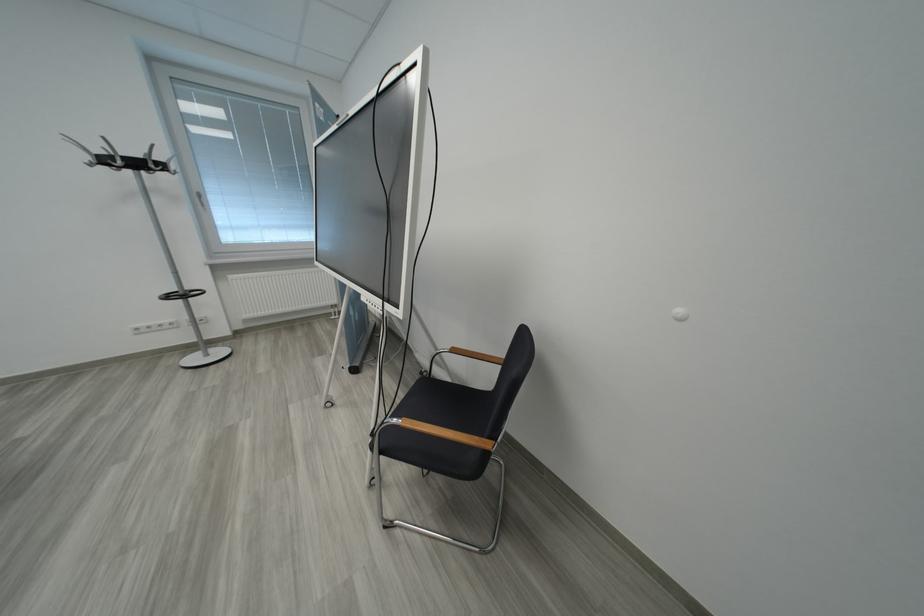
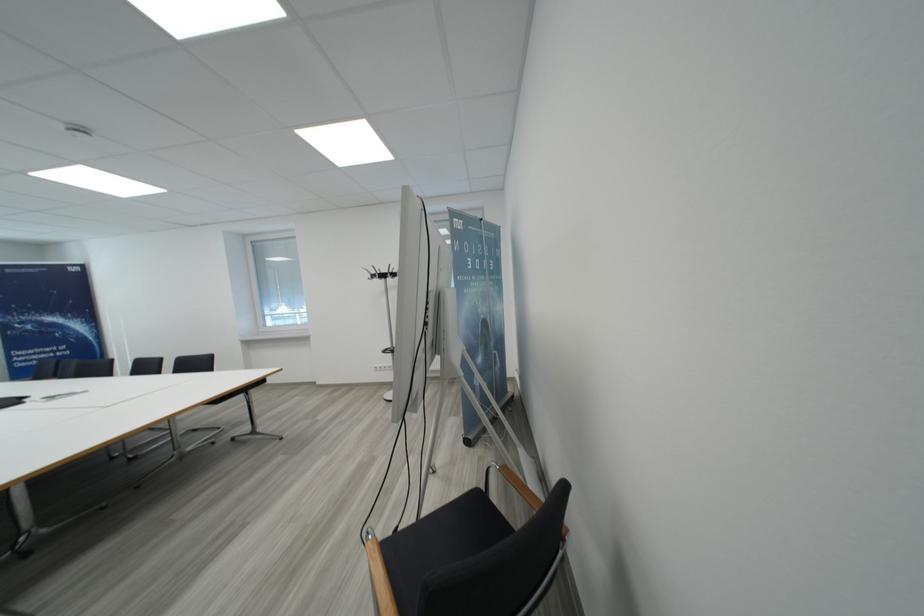
Question: How did the camera likely rotate?

Choices:
 (A) Left
 (B) Right
 (C) Up
 (D) Down

Answer: (A)